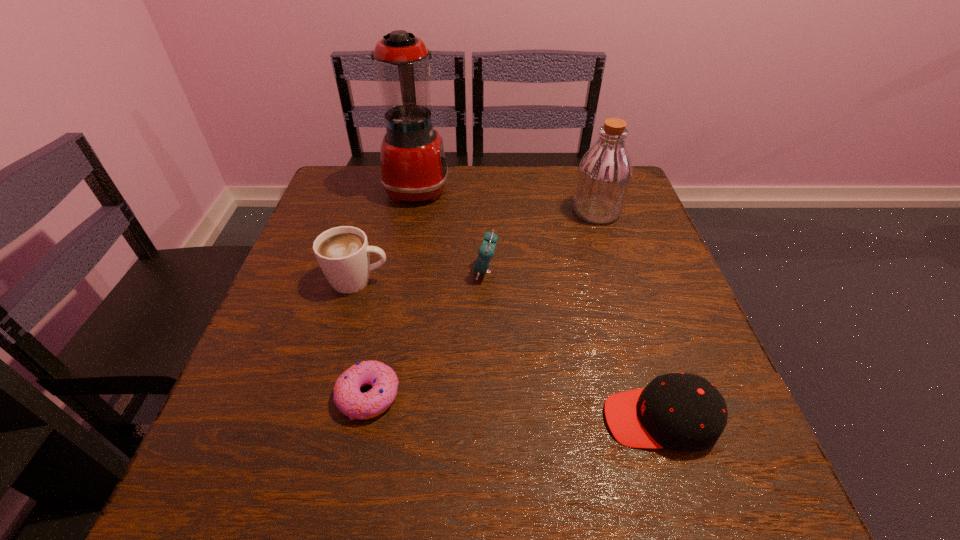
The image size is (960, 540). Find the location of `vacant space located 0.150m on the face of the third object from right to left`. vacant space located 0.150m on the face of the third object from right to left is located at coordinates (403, 272).

Locate an element on the screen. vacant space situated on the face of the third object from right to left is located at coordinates (292, 272).

At what (x,y) coordinates should I click in order to perform the action: click on free spot located 0.080m on the front-facing side of the cap. Please return your answer as a coordinate pair (x, y). The width and height of the screenshot is (960, 540). Looking at the image, I should click on (554, 420).

I want to click on blank space located 0.090m on the front-facing side of the cap, so click(x=548, y=420).

Find the location of `free space located on the front-facing side of the cap`. free space located on the front-facing side of the cap is located at coordinates (566, 420).

At what (x,y) coordinates should I click in order to perform the action: click on vacant area situated on the back of the doughnut. Please return your answer as a coordinate pair (x, y). This screenshot has width=960, height=540. Looking at the image, I should click on (396, 265).

I want to click on food processor located in the far edge section of the desktop, so click(413, 166).

Locate an element on the screen. The width and height of the screenshot is (960, 540). bottle that is at the far edge is located at coordinates (604, 175).

At what (x,y) coordinates should I click in order to perform the action: click on object that is at the near edge. Please return your answer as a coordinate pair (x, y). Looking at the image, I should click on (683, 412).

Where is `food processor that is at the left edge`? food processor that is at the left edge is located at coordinates (413, 166).